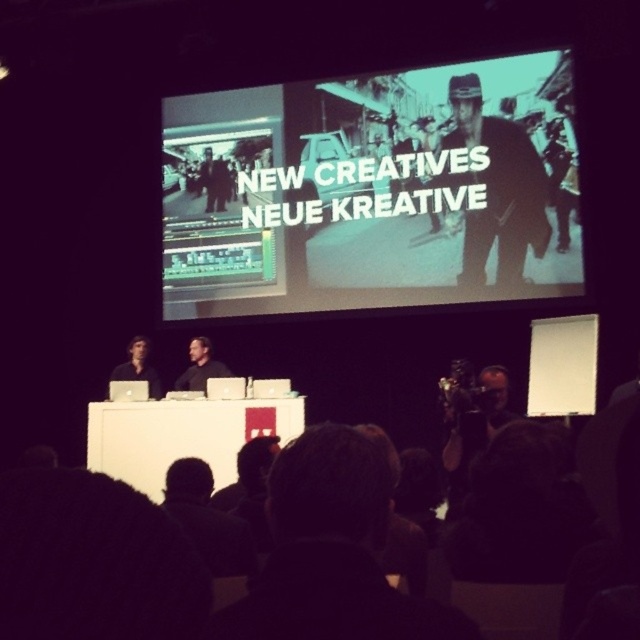
You are an attendee at the presentation and want to know which object in the front row is wider between the black shirt at center and the matte black laptop at left. Can you determine this?

The black shirt at center has a lesser width compared to the matte black laptop at left, so the matte black laptop at left is wider.

You are a photographer adjusting your camera settings to capture the presentation. You notice two points in the scene at coordinates point (480,216) and point (180,384). Which point should you focus on to ensure the foreground elements are sharp?

Point (480,216) should be focused on because it is closer to the camera than point (180,384), ensuring the foreground elements are in sharp focus.

You are an attendee at the presentation. You notice the teal matte projection screen at center and the black shirt at center. Which object is positioned higher in the image?

The teal matte projection screen at center is positioned higher than the black shirt at center in the image.